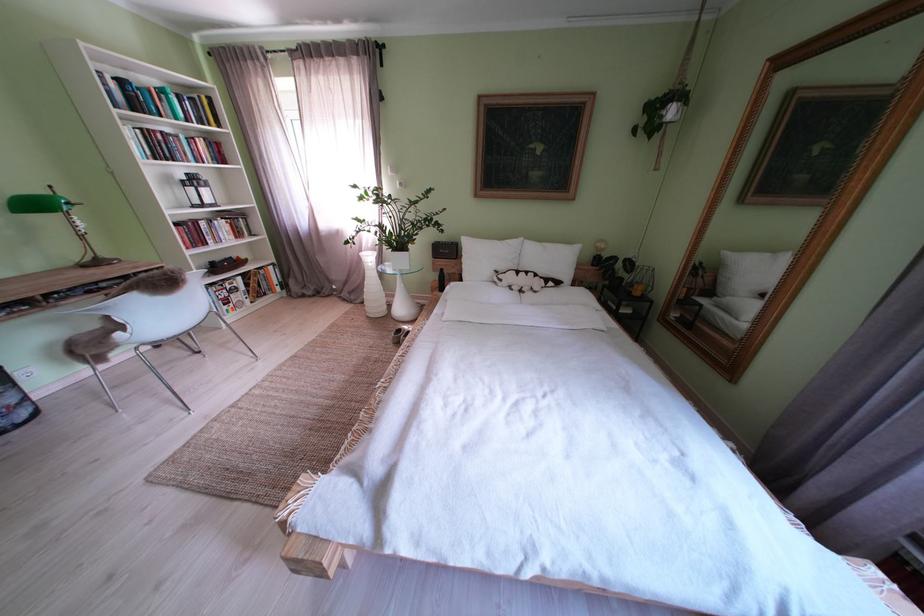
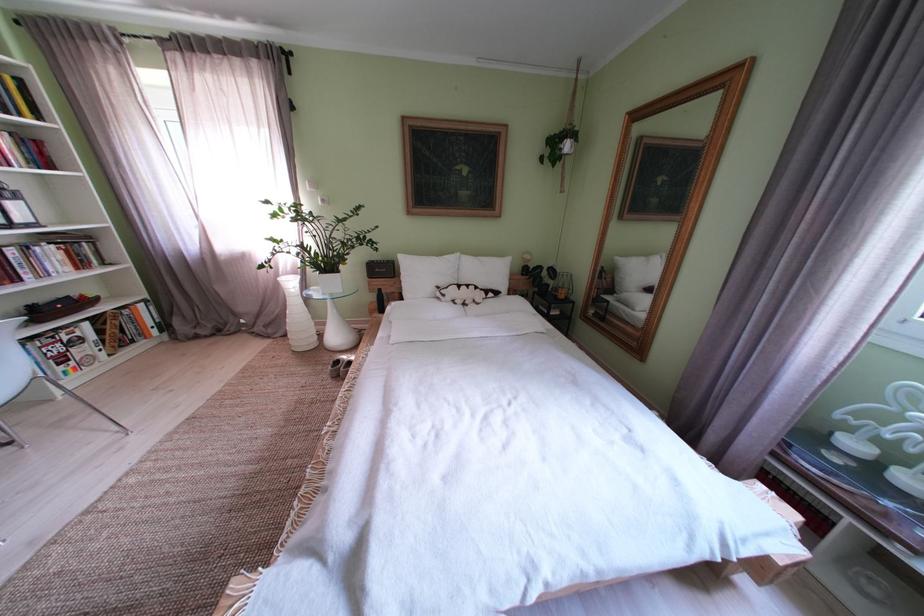
The point at (x=490, y=262) is marked in the first image. Where is the corresponding point in the second image?

(429, 280)